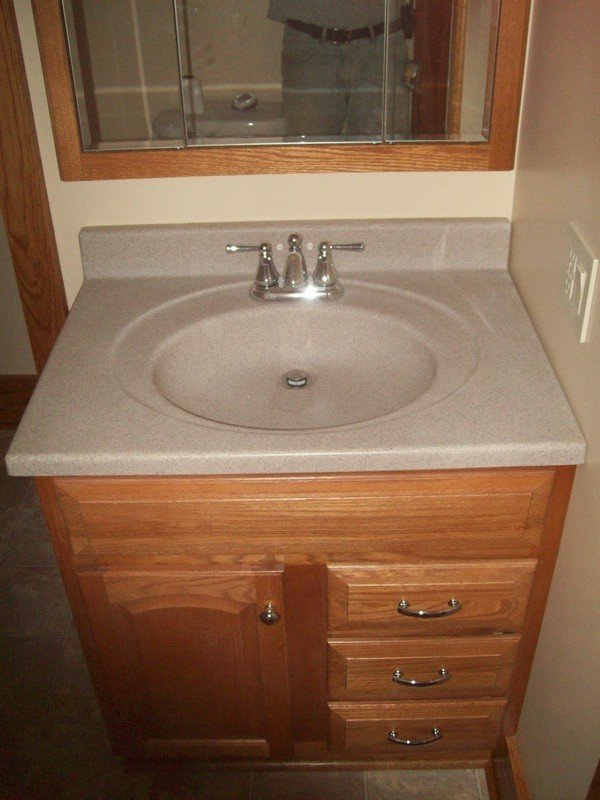
You are a GUI agent. You are given a task and a screenshot of the screen. Output one action in this format:
    pyautogui.click(x=<x>, y=<y>)
    Task: Click on the tap
    The height and width of the screenshot is (800, 600).
    Given the screenshot: What is the action you would take?
    pyautogui.click(x=266, y=282), pyautogui.click(x=300, y=280), pyautogui.click(x=323, y=280)